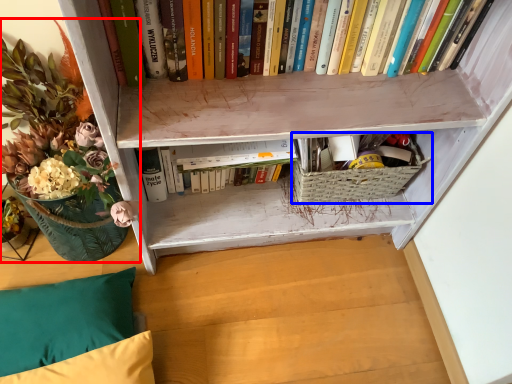
Question: Which object appears farthest to the camera in this image, floral arrangement (highlighted by a red box) or basket (highlighted by a blue box)?

Choices:
 (A) floral arrangement
 (B) basket

Answer: (B)